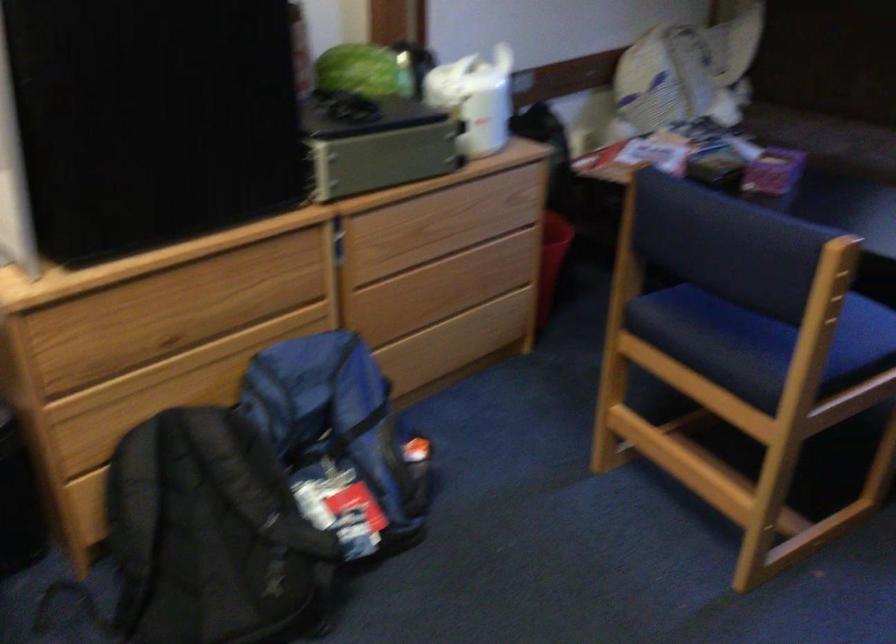
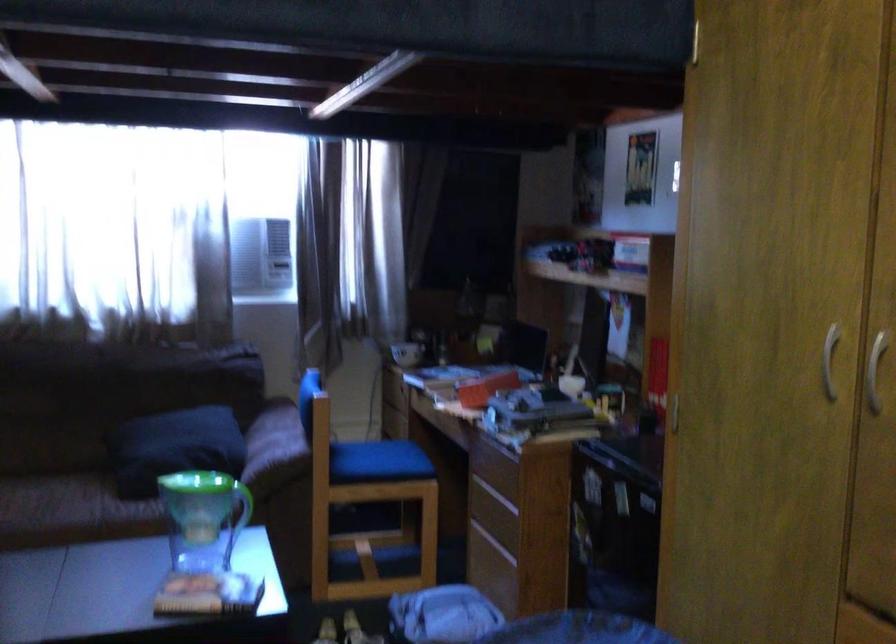
Question: The first image is from the beginning of the video and the second image is from the end. How did the camera likely rotate when shooting the video?

Choices:
 (A) Left
 (B) Right
 (C) Up
 (D) Down

Answer: (B)